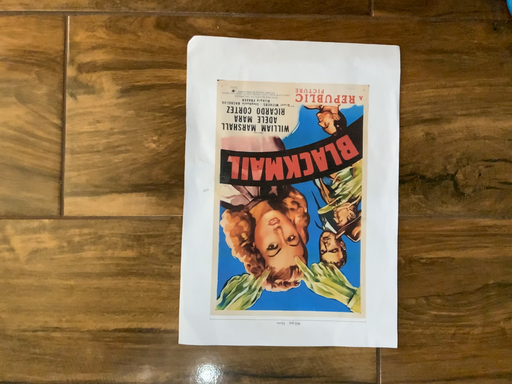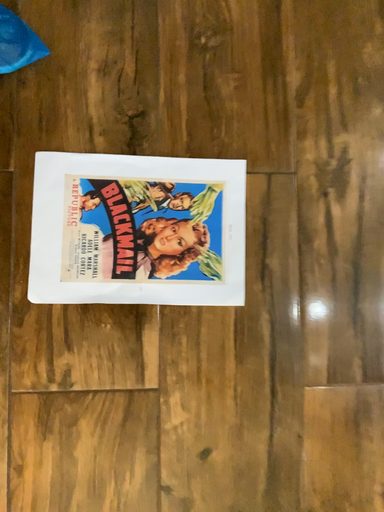
Question: Which way did the camera rotate in the video?

Choices:
 (A) rotated left
 (B) rotated right

Answer: (B)